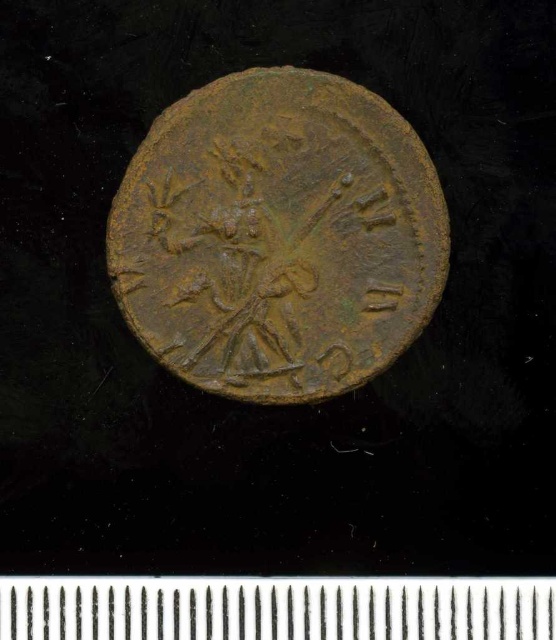
Question: Is the position of rusty bronze coin at center more distant than that of metallic silver ruler at center?

Choices:
 (A) no
 (B) yes

Answer: (B)

Question: Among these objects, which one is farthest from the camera?

Choices:
 (A) rusty bronze coin at center
 (B) metallic silver ruler at center

Answer: (A)

Question: Among these points, which one is farthest from the camera?

Choices:
 (A) (43, 616)
 (B) (259, 310)

Answer: (B)

Question: Is the position of rusty bronze coin at center less distant than that of metallic silver ruler at center?

Choices:
 (A) no
 (B) yes

Answer: (A)

Question: Can you confirm if rusty bronze coin at center is thinner than metallic silver ruler at center?

Choices:
 (A) no
 (B) yes

Answer: (B)